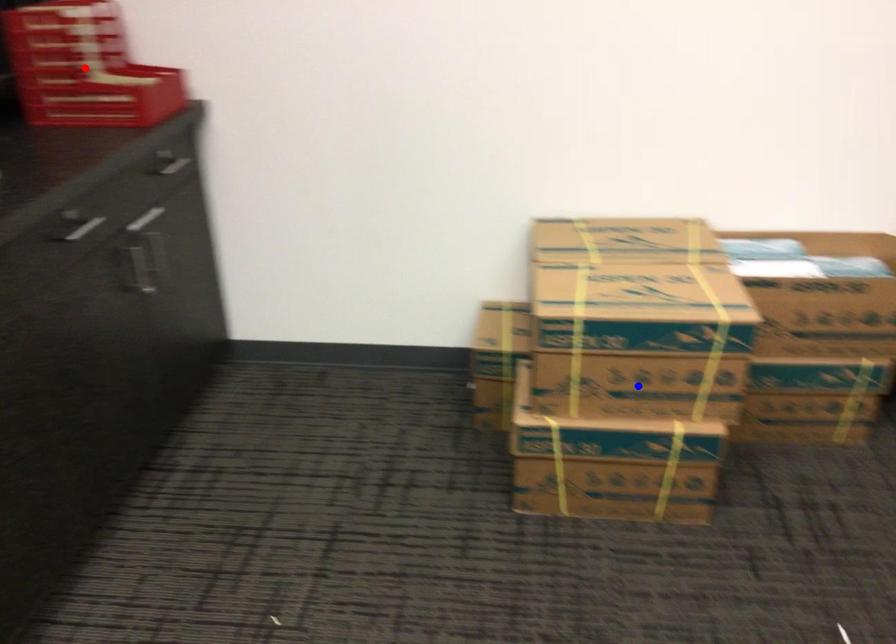
Question: Which of the two points in the image is closer to the camera?

Choices:
 (A) Blue point is closer.
 (B) Red point is closer.

Answer: (A)